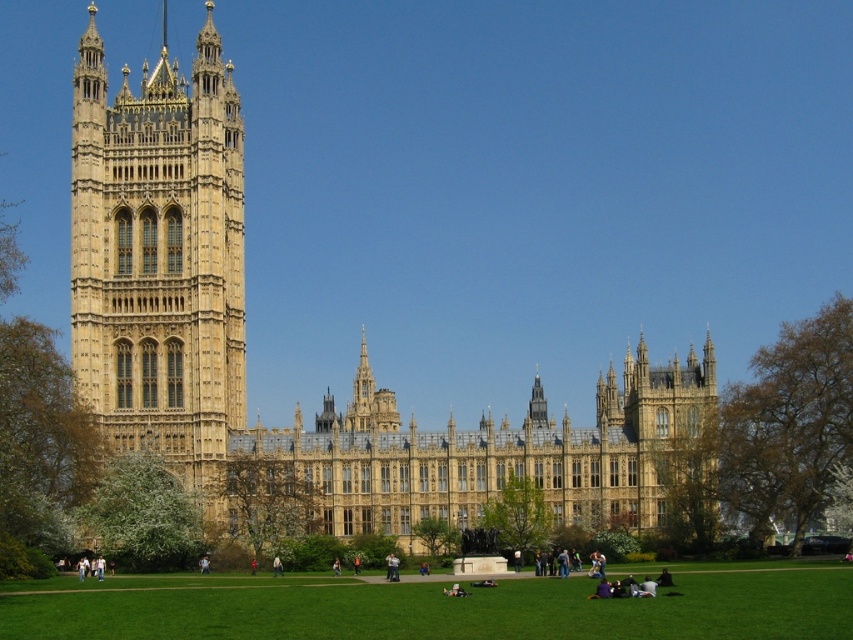
Is golden stone palace at left shorter than golden stone tower at left?

No.

Is golden stone palace at left to the right of golden stone tower at left from the viewer's perspective?

Yes, golden stone palace at left is to the right of golden stone tower at left.

This screenshot has width=853, height=640. I want to click on golden stone palace at left, so click(328, 388).

This screenshot has height=640, width=853. In order to click on golden stone palace at left in this screenshot , I will do `click(328, 388)`.

Between golden stone tower at left and green grass at lower center, which one is positioned lower?

green grass at lower center is below.

Based on the photo, who is more distant from viewer, (x=171, y=340) or (x=213, y=579)?

Positioned behind is point (x=171, y=340).

What do you see at coordinates (160, 259) in the screenshot? This screenshot has width=853, height=640. I see `golden stone tower at left` at bounding box center [160, 259].

Find the location of `golden stone tower at left`. golden stone tower at left is located at coordinates (160, 259).

Does golden stone palace at left have a smaller size compared to green grass at lower center?

Incorrect, golden stone palace at left is not smaller in size than green grass at lower center.

Which is more to the right, golden stone palace at left or green grass at lower center?

Positioned to the right is green grass at lower center.

Who is more distant from viewer, (109, 272) or (759, 588)?

Positioned behind is point (109, 272).

This screenshot has width=853, height=640. Identify the location of golden stone palace at left. (328, 388).